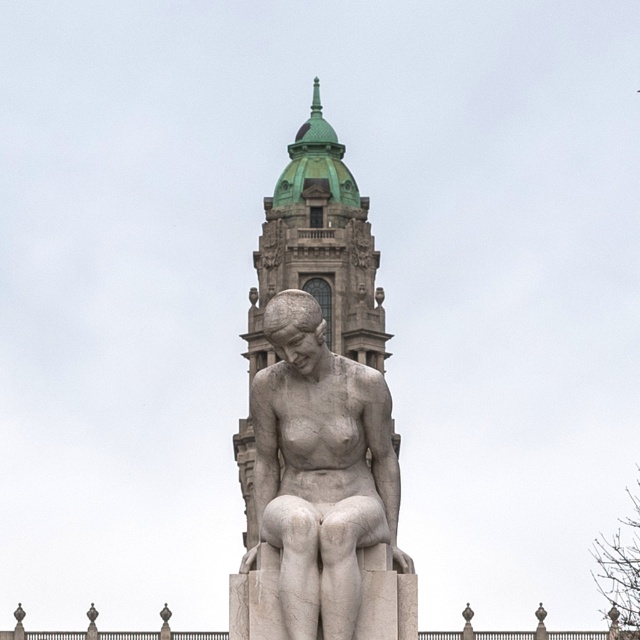
Measure the distance between white marble statue at center and camera.

white marble statue at center is 166.18 feet from camera.

Is white marble statue at center to the left of green stone bell tower at center from the viewer's perspective?

Correct, you'll find white marble statue at center to the left of green stone bell tower at center.

Does point (324, 400) come farther from viewer compared to point (371, 317)?

No, (324, 400) is in front of (371, 317).

I want to click on white marble statue at center, so click(321, 472).